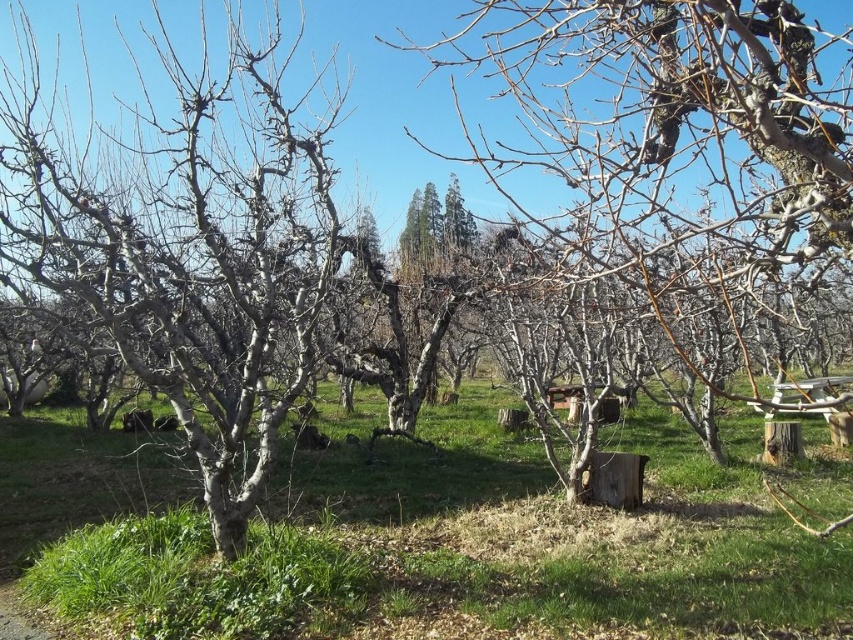
Question: Which object appears farthest from the camera in this image?

Choices:
 (A) green grassy at center
 (B) smooth gray tree at center

Answer: (A)

Question: Does green grassy at center have a greater width compared to smooth gray tree at center?

Choices:
 (A) no
 (B) yes

Answer: (B)

Question: Does smooth bark tree at center have a larger size compared to smooth gray tree at center?

Choices:
 (A) no
 (B) yes

Answer: (A)

Question: Among these objects, which one is nearest to the camera?

Choices:
 (A) smooth bark tree at center
 (B) smooth gray tree at center
 (C) green grassy at center

Answer: (A)

Question: Does smooth bark tree at center appear on the left side of smooth gray tree at center?

Choices:
 (A) yes
 (B) no

Answer: (B)

Question: Which of the following is the closest to the observer?

Choices:
 (A) (724, 205)
 (B) (12, 129)
 (C) (259, 580)

Answer: (B)